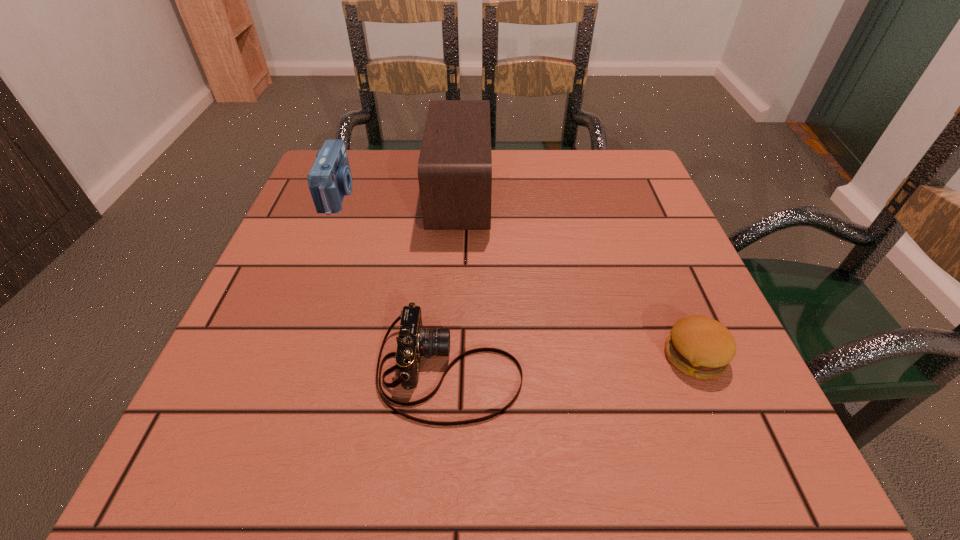
The image size is (960, 540). Find the location of `the tallest object`. the tallest object is located at coordinates (455, 163).

The height and width of the screenshot is (540, 960). In order to click on the leftmost object in this screenshot , I will do `click(329, 179)`.

This screenshot has height=540, width=960. Find the location of `the third shortest object`. the third shortest object is located at coordinates (329, 179).

Find the location of a particular element. the right camera is located at coordinates (413, 341).

At what (x,y) coordinates should I click in order to perform the action: click on the shorter camera. Please return your answer as a coordinate pair (x, y). Looking at the image, I should click on (413, 341).

What are the coordinates of `hamburger` in the screenshot? It's located at (701, 347).

Find the location of `vacant area located 0.360m on the front-facing side of the tallest object`. vacant area located 0.360m on the front-facing side of the tallest object is located at coordinates (646, 196).

Identify the location of vacant space located on the lens of the third shortest object. (430, 194).

In order to click on vacant space located on the front-facing side of the right camera in this screenshot , I will do `click(734, 370)`.

You are a GUI agent. You are given a task and a screenshot of the screen. Output one action in this format:
    pyautogui.click(x=<x>, y=<y>)
    Task: Click on the blank space located 0.370m on the left of the hamburger
    The height and width of the screenshot is (540, 960).
    Given the screenshot: What is the action you would take?
    pyautogui.click(x=432, y=356)